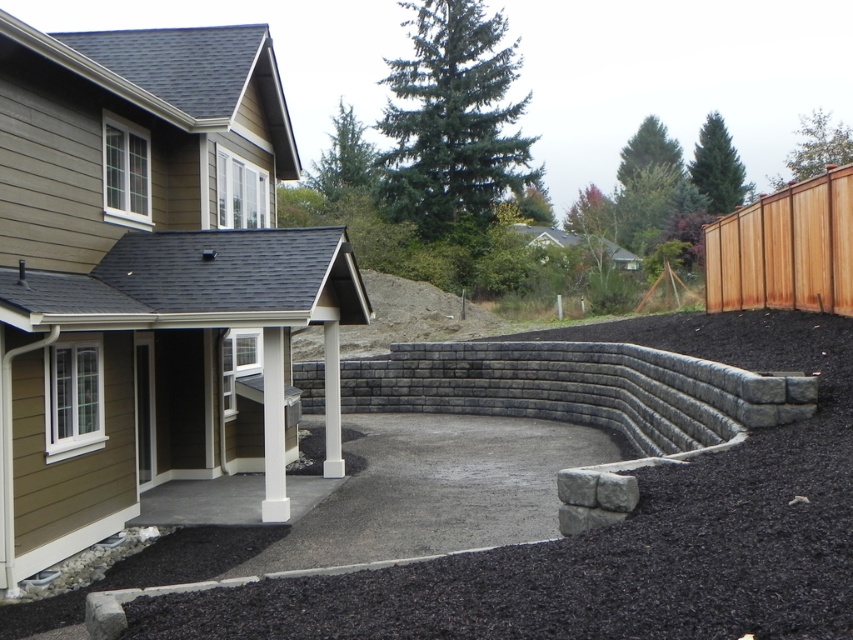
You are designing a garden layout and need to place a 1.2 meter tall garden statue. You have two options for placement locations based on the image. The first location is on the black gravel at lower center, and the second is near the brown wood fence at upper right. Which location would allow the statue to be visible from the front yard without obstruction?

The brown wood fence at upper right is taller than the black gravel at lower center. Placing the statue near the brown wood fence at upper right ensures it will be visible over the shorter black gravel at lower center.

You are standing on the gray concrete patio at center and want to walk to the black gravel at lower center. Which direction should you move to reach it?

The black gravel at lower center is behind the gray concrete patio at center, so you should move backward to reach it.

You are planning to install a new garden bed in the backyard. You want to place it on the higher ground to prevent waterlogging. Based on the scene, which area should you choose between the gray concrete patio at center and the black gravel at lower center?

The gray concrete patio at center is located above black gravel at lower center, so you should choose the gray concrete patio at center for the garden bed to avoid waterlogging.